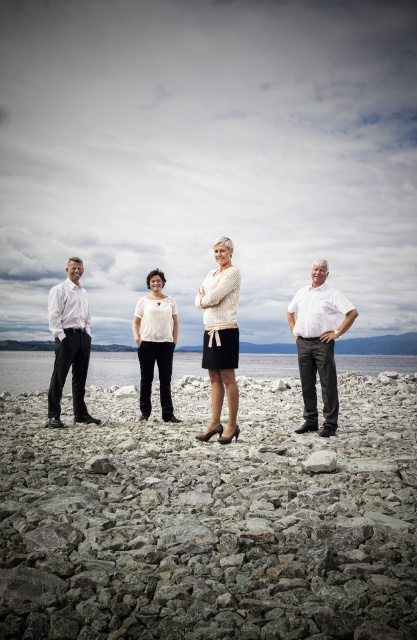
You are standing on the rocky shoreline and want to place a small object on the ground. Which item, the gray gravel at center or the white knit sweater at center, would be more suitable as a stable base for the object?

The gray gravel at center is shorter than the white knit sweater at center, so the white knit sweater at center would provide a more stable base for the object since it is taller and less likely to shift.